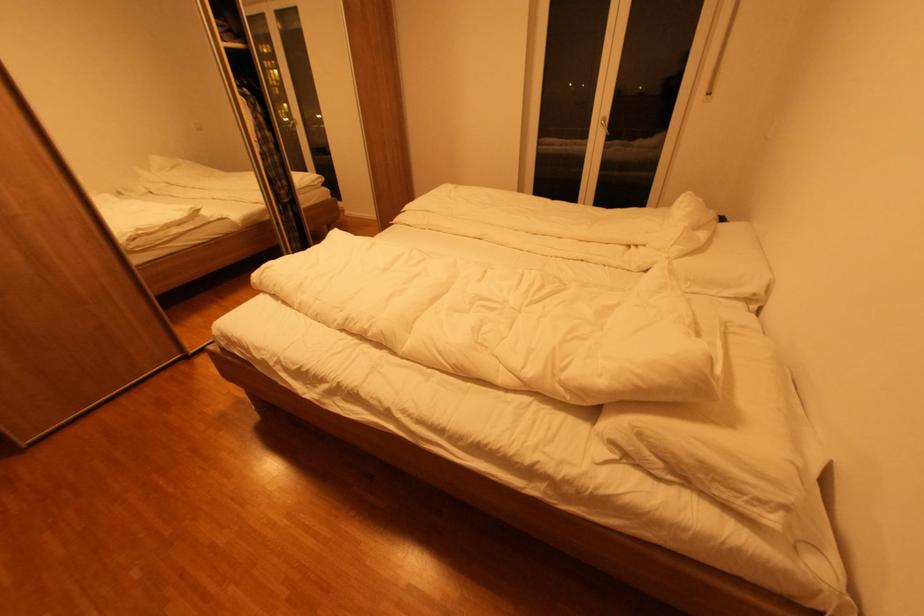
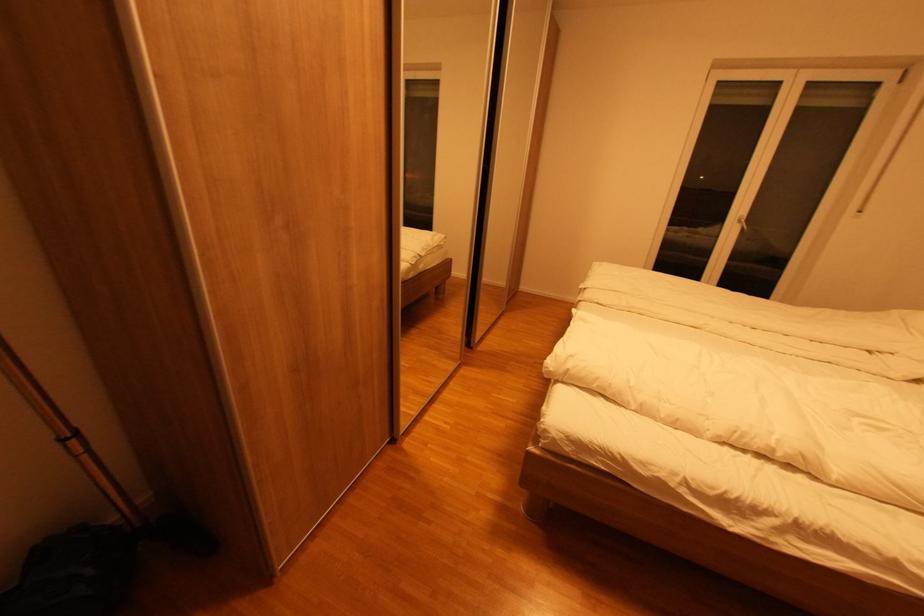
Question: What movement of the cameraman would produce the second image?

Choices:
 (A) Left
 (B) Right
 (C) Forward
 (D) Backward

Answer: (A)